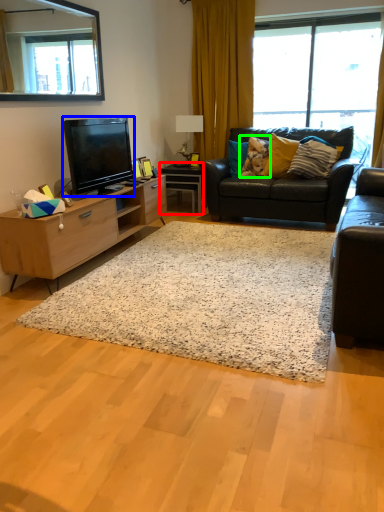
Question: Based on their relative distances, which object is nearer to desk (highlighted by a red box)? Choose from television (highlighted by a blue box) and pillow (highlighted by a green box).

Choices:
 (A) television
 (B) pillow

Answer: (B)